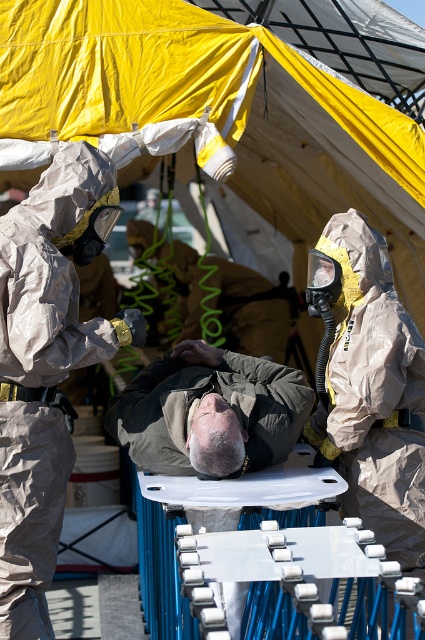
You are a safety officer in a hazardous materials team. You need to ensure that all team members are maintaining a safe distance from each other. You observe two team members wearing gray matte uniform at center and matte gray uniform at center. Are they within the required 5 meters safety distance?

The distance between gray matte uniform at center and matte gray uniform at center is 4.38 meters, which is within the required 5 meters safety distance.

You are a first responder entering the scene and see two individuals in protective gear. The first is wearing a gray matte uniform at center, and the second is wearing a matte gray uniform at center. Which individual is closer to you?

The gray matte uniform at center is closer to the viewer than the matte gray uniform at center.